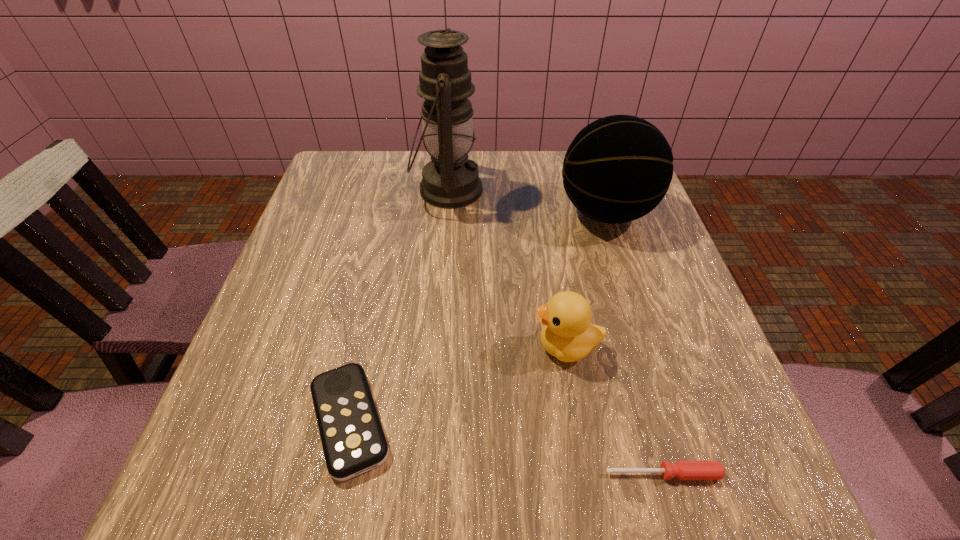
Locate an element on the screen. The width and height of the screenshot is (960, 540). oil lamp is located at coordinates pyautogui.click(x=450, y=180).

The image size is (960, 540). Find the location of `basketball`. basketball is located at coordinates (617, 169).

Where is `the third shortest object`? The height and width of the screenshot is (540, 960). the third shortest object is located at coordinates tap(567, 334).

Identify the location of the third farthest object. This screenshot has width=960, height=540. (567, 334).

In order to click on the fourth tallest object in this screenshot , I will do `click(353, 440)`.

Locate an element on the screen. This screenshot has width=960, height=540. screwdriver is located at coordinates (684, 470).

Find the location of a particular element. This screenshot has height=540, width=960. free location located on the front of the tallest object is located at coordinates (438, 299).

Locate an element on the screen. The image size is (960, 540). free region located on the left of the basketball is located at coordinates (424, 213).

Locate an element on the screen. Image resolution: width=960 pixels, height=540 pixels. blank area located 0.230m on the face of the third tallest object is located at coordinates (403, 346).

You are a GUI agent. You are given a task and a screenshot of the screen. Output one action in this format:
    pyautogui.click(x=<x>, y=<y>)
    Task: Click on the vacant region located on the face of the third tallest object
    
    Given the screenshot: What is the action you would take?
    pyautogui.click(x=371, y=346)